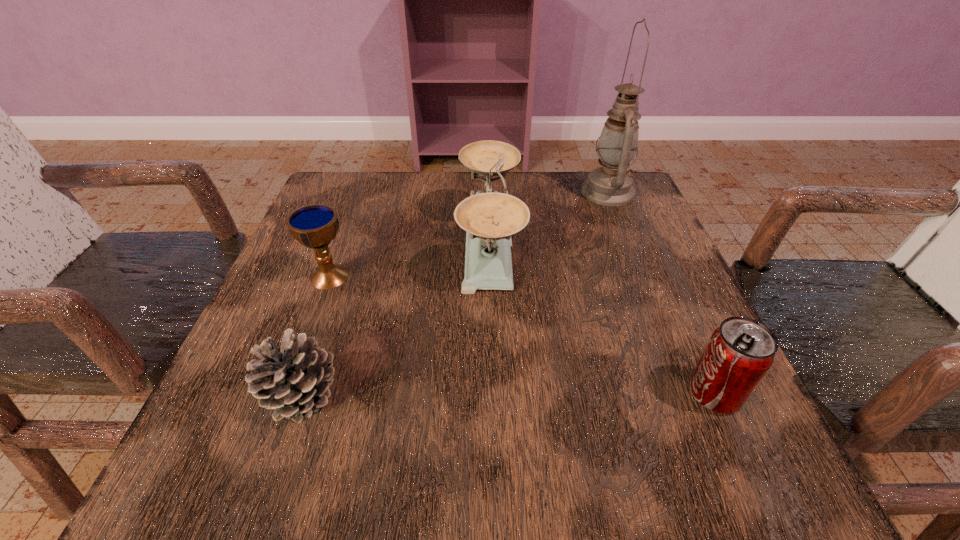
The width and height of the screenshot is (960, 540). In order to click on free space in the image that satisfies the following two spatial constraints: 1. on the front side of the oil lamp; 2. on the right side of the pop soda in this screenshot , I will do 689,393.

The height and width of the screenshot is (540, 960). I want to click on free location that satisfies the following two spatial constraints: 1. on the front-facing side of the third object from right to left; 2. on the right side of the pop soda, so click(493, 393).

The image size is (960, 540). What are the coordinates of `free space that satisfies the following two spatial constraints: 1. on the front side of the pinecone; 2. on the left side of the chalice` in the screenshot? It's located at tap(284, 395).

The height and width of the screenshot is (540, 960). In order to click on vacant space that satisfies the following two spatial constraints: 1. on the front-facing side of the fourth shortest object; 2. on the right side of the pop soda in this screenshot , I will do `click(493, 393)`.

Image resolution: width=960 pixels, height=540 pixels. Identify the location of free location that satisfies the following two spatial constraints: 1. on the front-facing side of the pop soda; 2. on the right side of the third object from left to right. (493, 393).